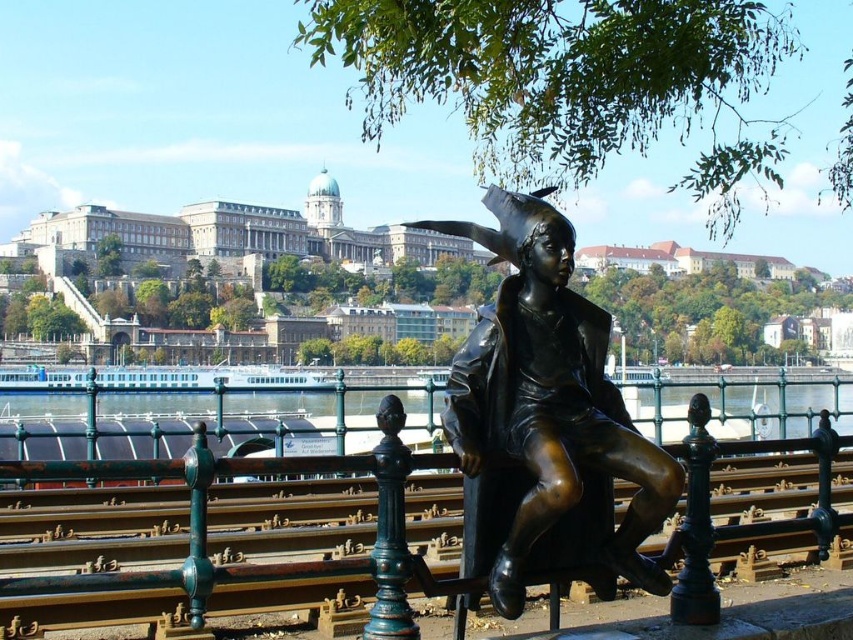
Is the position of bronze at center more distant than that of bronze statue at center?

That is False.

From the picture: Is bronze at center shorter than bronze statue at center?

Indeed, bronze at center has a lesser height compared to bronze statue at center.

Where is `bronze at center`? This screenshot has height=640, width=853. bronze at center is located at coordinates (264, 540).

Locate an element on the screen. bronze at center is located at coordinates (264, 540).